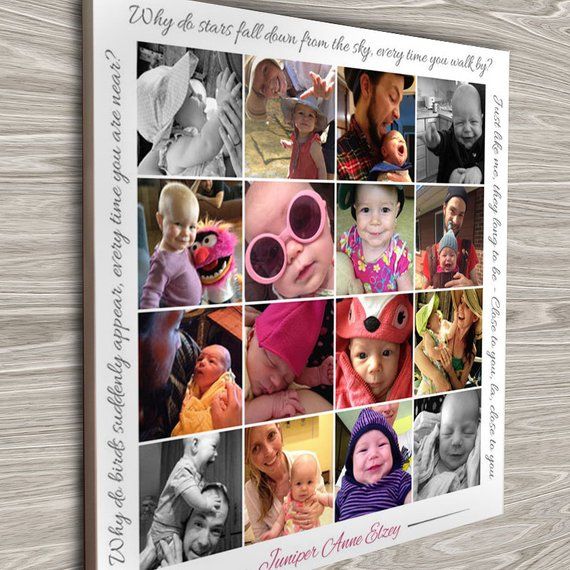
Identify the location of number of black and white photos. (445, 450), (197, 500), (194, 130), (447, 142).